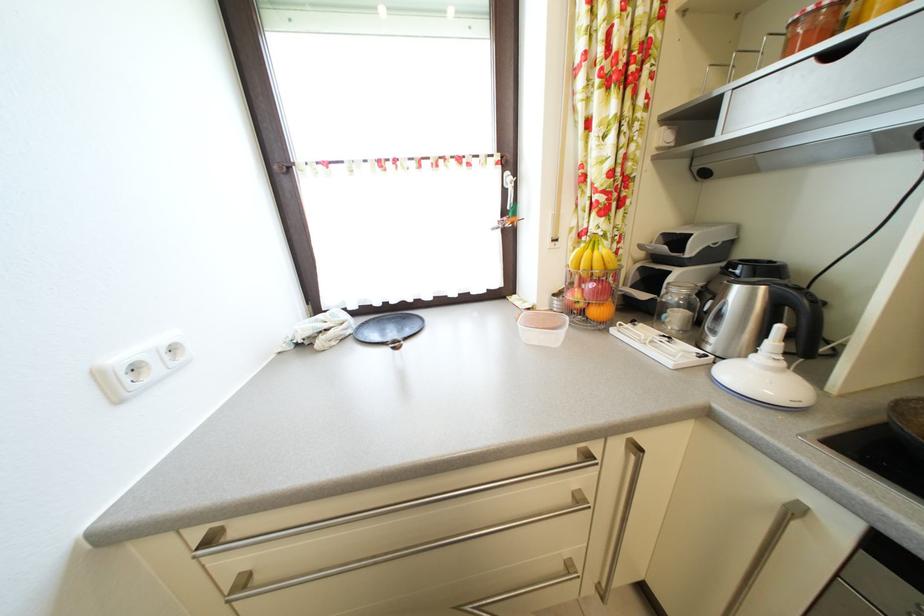
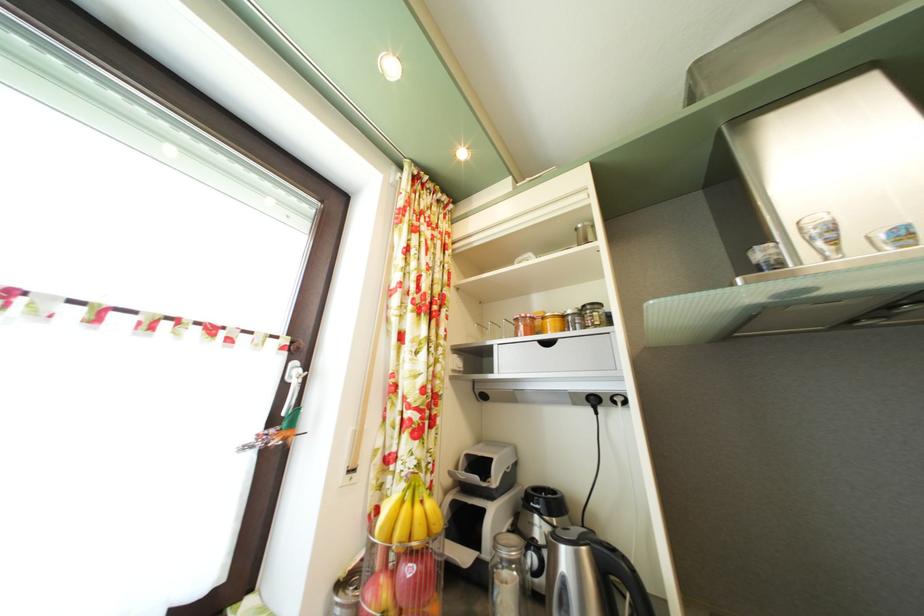
Find the pixel in the second image that matches the point at 675,328 in the first image.

(506, 608)